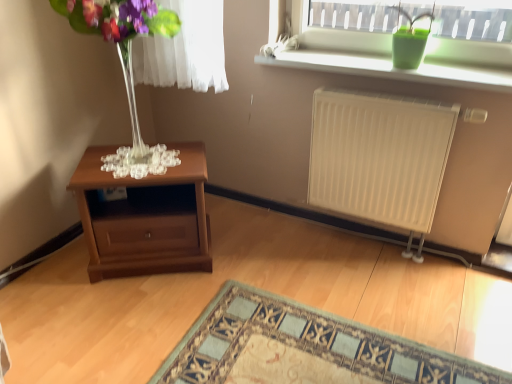
Locate an element on the screen. The height and width of the screenshot is (384, 512). free point behind carpet with intricate pattern at lower center is located at coordinates (327, 271).